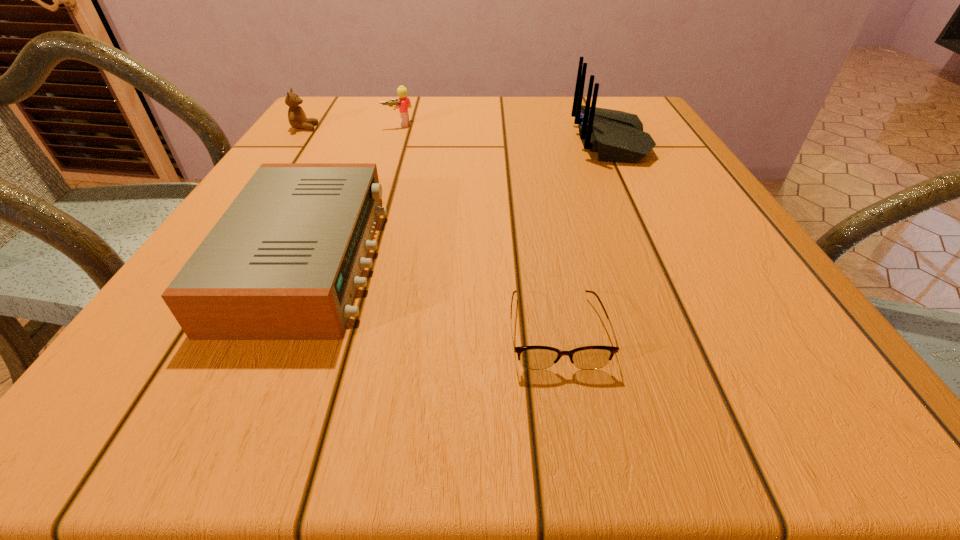
I want to click on free space that satisfies the following two spatial constraints: 1. in front of the Lego with the accessory visible; 2. on the control panel of the radio receiver, so click(x=353, y=260).

Locate an element on the screen. free location that satisfies the following two spatial constraints: 1. on the back of the tallest object; 2. on the face of the second object from right to left is located at coordinates (704, 330).

The width and height of the screenshot is (960, 540). In order to click on vacant space that satisfies the following two spatial constraints: 1. in front of the Lego with the accessory visible; 2. on the front-facing side of the teddy bear in this screenshot , I will do `click(397, 127)`.

This screenshot has width=960, height=540. Find the location of `free location that satisfies the following two spatial constraints: 1. in front of the Lego with the accessory visible; 2. on the front-facing side of the leftmost object`. free location that satisfies the following two spatial constraints: 1. in front of the Lego with the accessory visible; 2. on the front-facing side of the leftmost object is located at coordinates (397, 127).